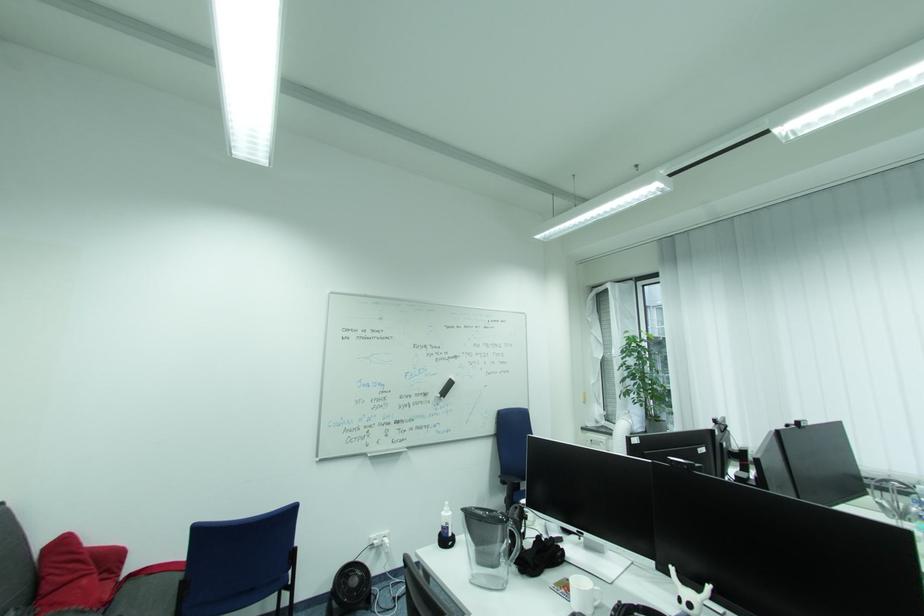
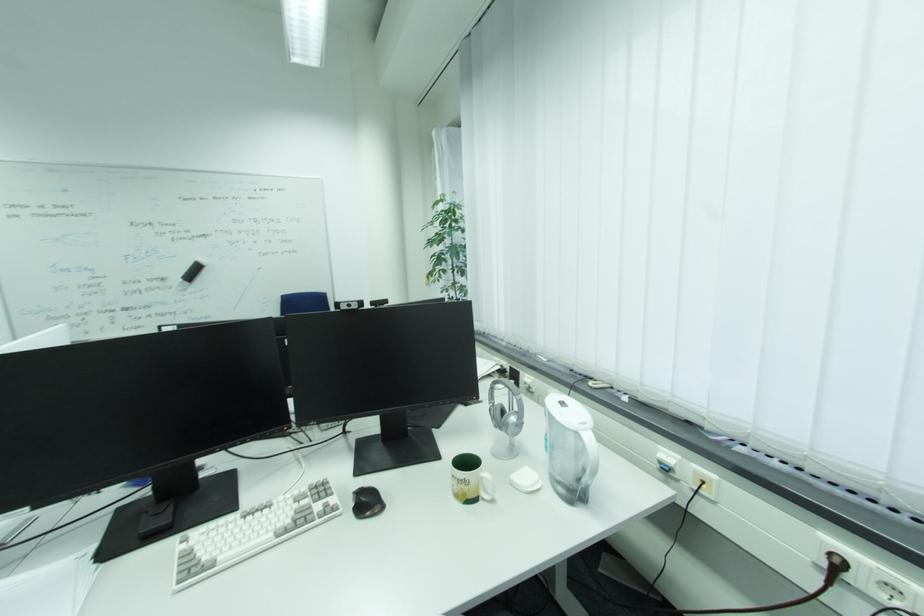
Question: What movement of the cameraman would produce the second image?

Choices:
 (A) Left
 (B) Right
 (C) Forward
 (D) Backward

Answer: (B)